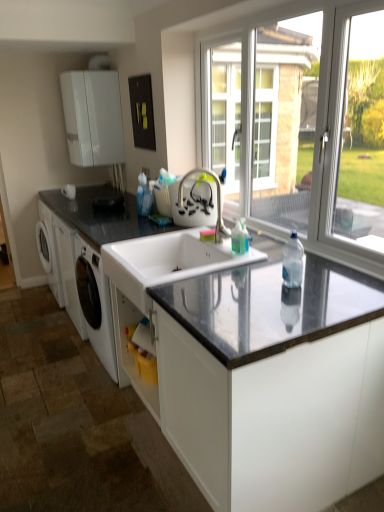
Question: In terms of width, does white matte cabinet at upper left look wider or thinner when compared to clear plastic bottle at center?

Choices:
 (A) wide
 (B) thin

Answer: (A)

Question: Considering the positions of point (84, 141) and point (296, 279), is point (84, 141) closer or farther from the camera than point (296, 279)?

Choices:
 (A) closer
 (B) farther

Answer: (B)

Question: Which of these objects is positioned closest to the white ceramic sink at center?

Choices:
 (A) black granite countertop at left, which ranks as the 2th countertop in bottom-to-top order
 (B) satin nickel faucet at center
 (C) black granite countertop at center, which is the 1th countertop in bottom-to-top order
 (D) white matte cabinet at upper left
 (E) transparent glass window at upper right

Answer: (C)

Question: Which of these objects is positioned farthest from the clear plastic bottle at center?

Choices:
 (A) black granite countertop at center, which is the 1th countertop in bottom-to-top order
 (B) black granite countertop at left, which is the first countertop in top-to-bottom order
 (C) transparent glass window at upper right
 (D) satin nickel faucet at center
 (E) white ceramic sink at center

Answer: (B)